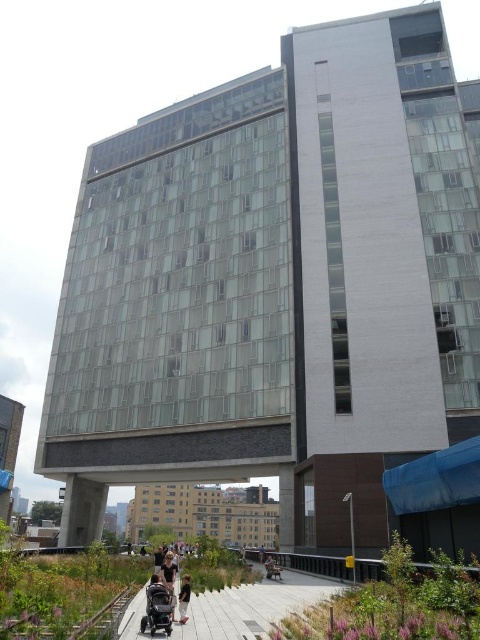
Question: Which of the following is the farthest from the observer?

Choices:
 (A) (244, 625)
 (B) (181, 609)
 (C) (171, 595)
 (D) (279, 572)

Answer: (D)

Question: Does black matte baby carriage at lower left have a greater width compared to light brown wooden chair at lower center?

Choices:
 (A) no
 (B) yes

Answer: (A)

Question: Which point is closer to the camera?

Choices:
 (A) matte black stroller at lower center
 (B) light brown leather jacket at lower center
 (C) concrete walkway at lower center
 (D) black matte baby carriage at lower left

Answer: (C)

Question: Which of the following is the closest to the observer?

Choices:
 (A) black matte baby carriage at lower left
 (B) light brown wooden chair at lower center
 (C) light brown leather jacket at lower center

Answer: (A)

Question: Considering the relative positions of matte black stroller at lower center and light brown leather jacket at lower center in the image provided, where is matte black stroller at lower center located with respect to light brown leather jacket at lower center?

Choices:
 (A) left
 (B) right

Answer: (A)

Question: Can you confirm if concrete walkway at lower center is bigger than light brown leather jacket at lower center?

Choices:
 (A) yes
 (B) no

Answer: (A)